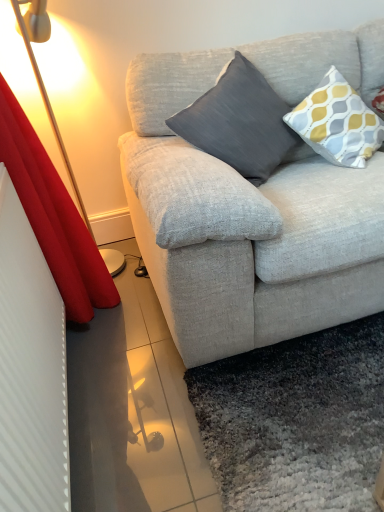
Question: In the image, is red velvet curtain at left positioned in front of or behind dark gray fabric pillow at center, placed as the second pillow when sorted from right to left?

Choices:
 (A) behind
 (B) front

Answer: (B)

Question: Looking at their shapes, would you say red velvet curtain at left is wider or thinner than dark gray fabric pillow at center, the 1th pillow positioned from the left?

Choices:
 (A) thin
 (B) wide

Answer: (A)

Question: Which object is the closest to the yellow and gray patterned pillow at upper right, marked as the first pillow in a right-to-left arrangement?

Choices:
 (A) dark gray fabric pillow at center, the 1th pillow positioned from the left
 (B) red velvet curtain at left

Answer: (A)

Question: Which object is the farthest from the yellow and gray patterned pillow at upper right, the 2th pillow viewed from the left?

Choices:
 (A) red velvet curtain at left
 (B) dark gray fabric pillow at center, placed as the second pillow when sorted from right to left

Answer: (A)